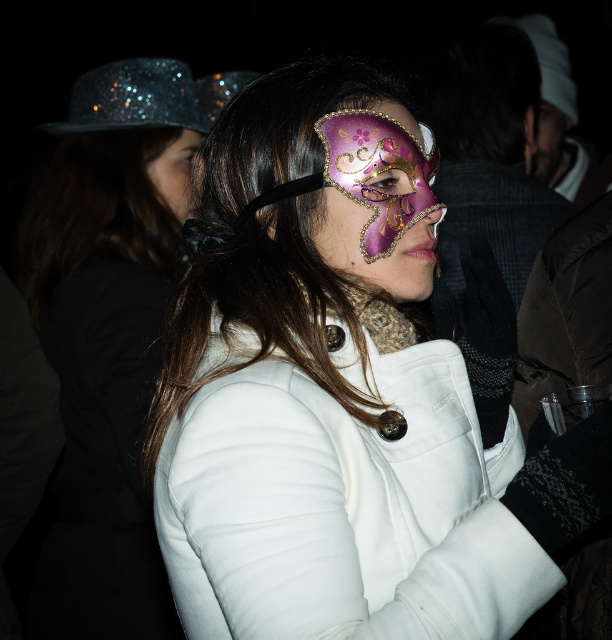
Which of these two, matte purple mask at center or matte white coat at center, stands shorter?

matte purple mask at center

Consider the image. Which is above, matte purple mask at center or matte white coat at center?

matte white coat at center is above.

The image size is (612, 640). What are the coordinates of `matte purple mask at center` in the screenshot? It's located at (326, 396).

Which of these two, matte purple mask at center or purple glossy mask at center, stands shorter?

purple glossy mask at center

Can you confirm if matte purple mask at center is thinner than purple glossy mask at center?

Incorrect, matte purple mask at center's width is not less than purple glossy mask at center's.

Locate an element on the screen. This screenshot has height=640, width=612. matte purple mask at center is located at coordinates (326, 396).

I want to click on matte purple mask at center, so click(x=326, y=396).

Can you confirm if matte white coat at center is positioned to the left of matte black hair at upper left?

Yes, matte white coat at center is to the left of matte black hair at upper left.

Who is more distant from viewer, [39,282] or [181,173]?

The point [181,173] is more distant.

The image size is (612, 640). Find the location of `matte white coat at center`. matte white coat at center is located at coordinates (105, 342).